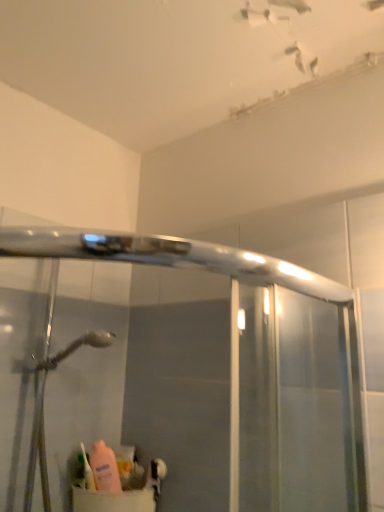
Question: Does pink matte sink at lower left lie behind translucent plastic toothbrush at lower left?

Choices:
 (A) no
 (B) yes

Answer: (A)

Question: Does pink matte sink at lower left have a lesser width compared to translucent plastic toothbrush at lower left?

Choices:
 (A) yes
 (B) no

Answer: (B)

Question: From the image's perspective, does pink matte sink at lower left appear lower than translucent plastic toothbrush at lower left?

Choices:
 (A) no
 (B) yes

Answer: (B)

Question: From a real-world perspective, is pink matte sink at lower left over translucent plastic toothbrush at lower left?

Choices:
 (A) yes
 (B) no

Answer: (B)

Question: Considering the relative sizes of pink matte sink at lower left and translucent plastic toothbrush at lower left in the image provided, is pink matte sink at lower left taller than translucent plastic toothbrush at lower left?

Choices:
 (A) yes
 (B) no

Answer: (B)

Question: Considering the relative positions of pink matte sink at lower left and translucent plastic toothbrush at lower left in the image provided, is pink matte sink at lower left to the left of translucent plastic toothbrush at lower left from the viewer's perspective?

Choices:
 (A) yes
 (B) no

Answer: (B)

Question: Considering the relative sizes of translucent plastic toothbrush at lower left and pink matte sink at lower left in the image provided, is translucent plastic toothbrush at lower left bigger than pink matte sink at lower left?

Choices:
 (A) no
 (B) yes

Answer: (A)

Question: Does translucent plastic toothbrush at lower left have a lesser height compared to pink matte sink at lower left?

Choices:
 (A) no
 (B) yes

Answer: (A)

Question: Is translucent plastic toothbrush at lower left positioned behind pink matte sink at lower left?

Choices:
 (A) yes
 (B) no

Answer: (A)

Question: Considering the relative sizes of translucent plastic toothbrush at lower left and pink matte sink at lower left in the image provided, is translucent plastic toothbrush at lower left taller than pink matte sink at lower left?

Choices:
 (A) no
 (B) yes

Answer: (B)

Question: From the image's perspective, would you say translucent plastic toothbrush at lower left is shown under pink matte sink at lower left?

Choices:
 (A) no
 (B) yes

Answer: (A)

Question: Would you say translucent plastic toothbrush at lower left is a long distance from pink matte sink at lower left?

Choices:
 (A) yes
 (B) no

Answer: (B)

Question: Is translucent plastic toothbrush at lower left taller or shorter than pink matte sink at lower left?

Choices:
 (A) tall
 (B) short

Answer: (A)